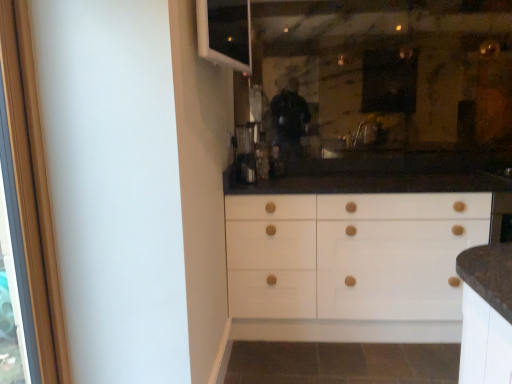
Question: Is metallic silver coffee machine at center taller or shorter than wooden screen door at left?

Choices:
 (A) short
 (B) tall

Answer: (A)

Question: From a real-world perspective, is metallic silver coffee machine at center above or below wooden screen door at left?

Choices:
 (A) below
 (B) above

Answer: (B)

Question: Which is nearer to the white plastic window at upper left?

Choices:
 (A) wooden screen door at left
 (B) metallic silver coffee machine at center

Answer: (B)

Question: Based on their relative distances, which object is nearer to the wooden screen door at left?

Choices:
 (A) metallic silver coffee machine at center
 (B) white plastic window at upper left

Answer: (B)